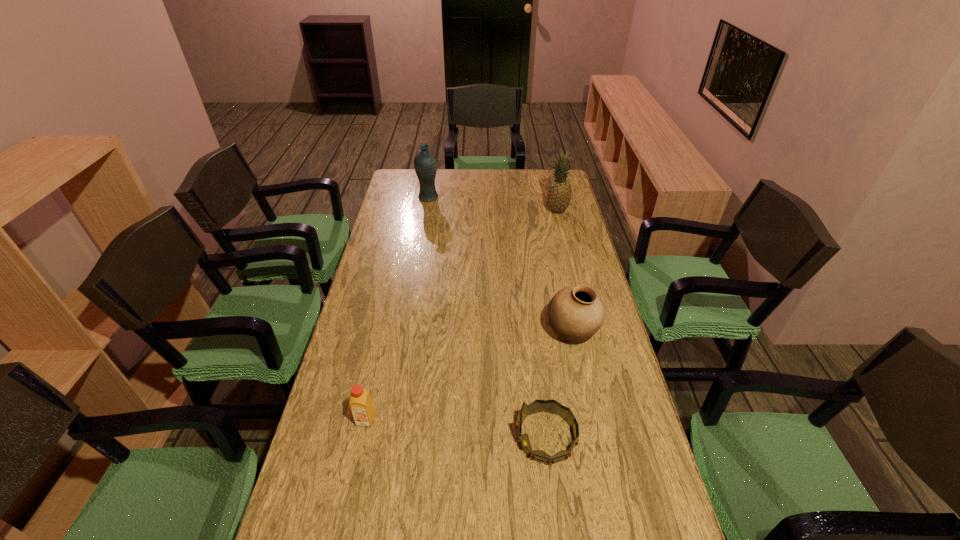
The width and height of the screenshot is (960, 540). In the image, there is a desktop. Identify the location of vacant space at the left edge. (x=393, y=258).

Where is `vacant space at the right edge of the desktop`? This screenshot has height=540, width=960. vacant space at the right edge of the desktop is located at coordinates (596, 333).

At what (x,y) coordinates should I click in order to perform the action: click on blank space at the far left corner of the desktop. Please return your answer as a coordinate pair (x, y). The width and height of the screenshot is (960, 540). Looking at the image, I should click on (405, 193).

Image resolution: width=960 pixels, height=540 pixels. In order to click on free spot between the orange juice and the pottery in this screenshot , I will do `click(468, 376)`.

Identify the location of vacant region between the pineapple and the vase. (492, 205).

The image size is (960, 540). Find the location of `free space between the third shortest object and the orange juice`. free space between the third shortest object and the orange juice is located at coordinates (468, 376).

What are the coordinates of `blank region between the vase and the third shortest object` in the screenshot? It's located at (500, 265).

Locate an element on the screen. vacant area between the pineapple and the farthest object is located at coordinates (492, 205).

Find the location of a particular element. free spot between the vase and the second farthest object is located at coordinates (492, 205).

The height and width of the screenshot is (540, 960). What are the coordinates of `vacant space that's between the vase and the pottery` in the screenshot? It's located at (500, 265).